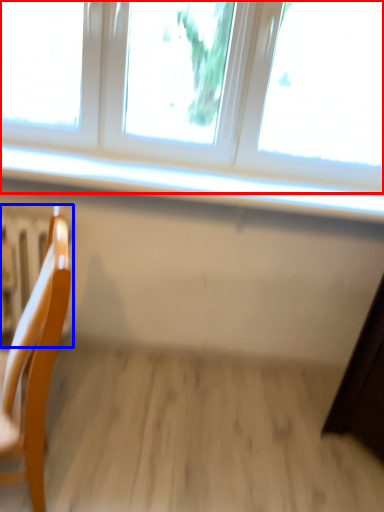
Question: Which object is closer to the camera taking this photo, window (highlighted by a red box) or radiator (highlighted by a blue box)?

Choices:
 (A) window
 (B) radiator

Answer: (A)